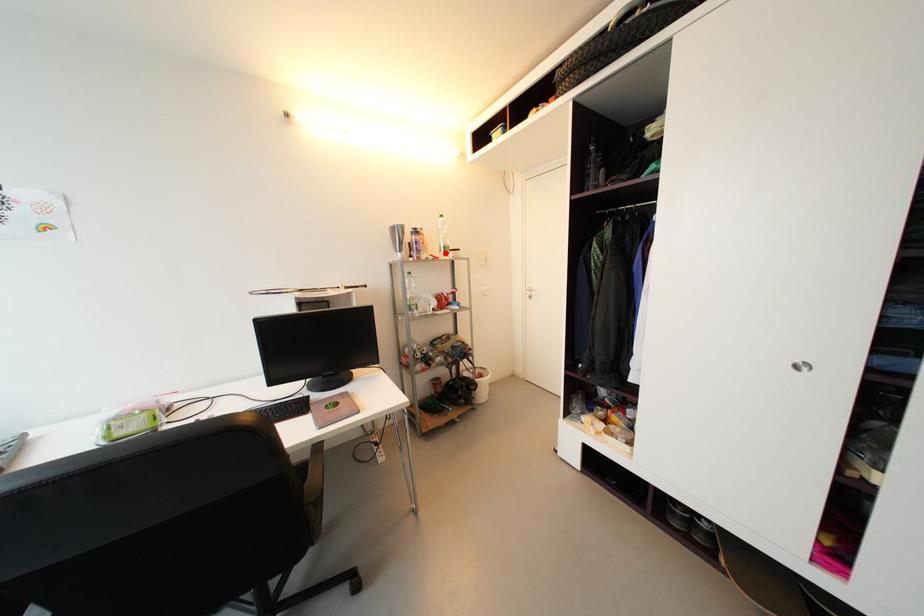
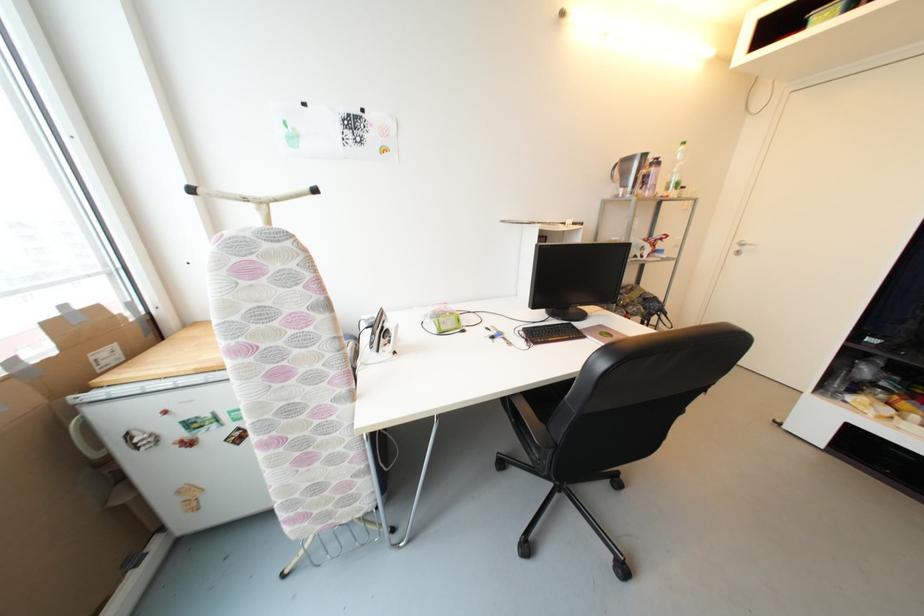
Find the pixel in the second image that matches the highlighted location in the first image.

(673, 190)